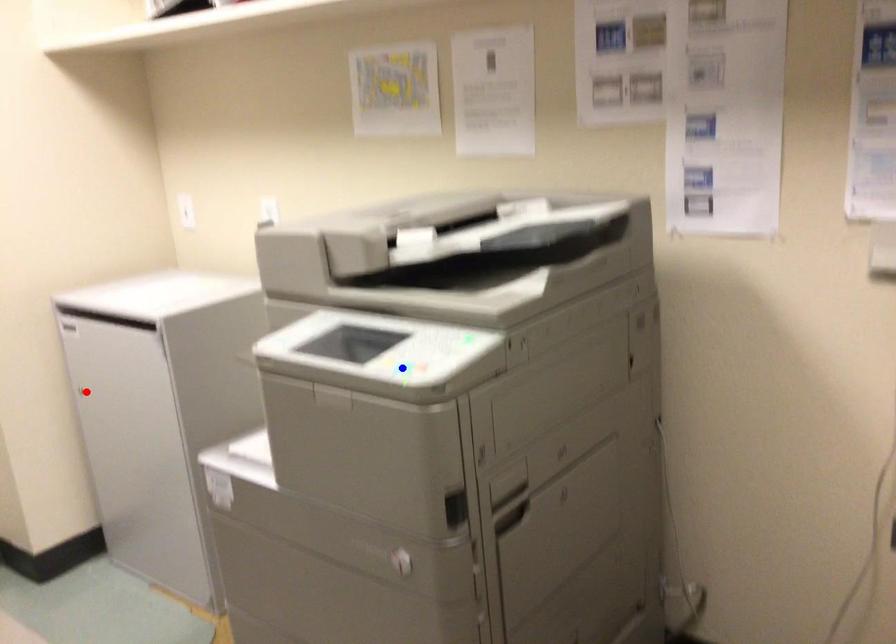
Question: In the image, two points are highlighted. Which point is nearer to the camera? Reply with the corresponding letter.

Choices:
 (A) blue point
 (B) red point

Answer: (A)